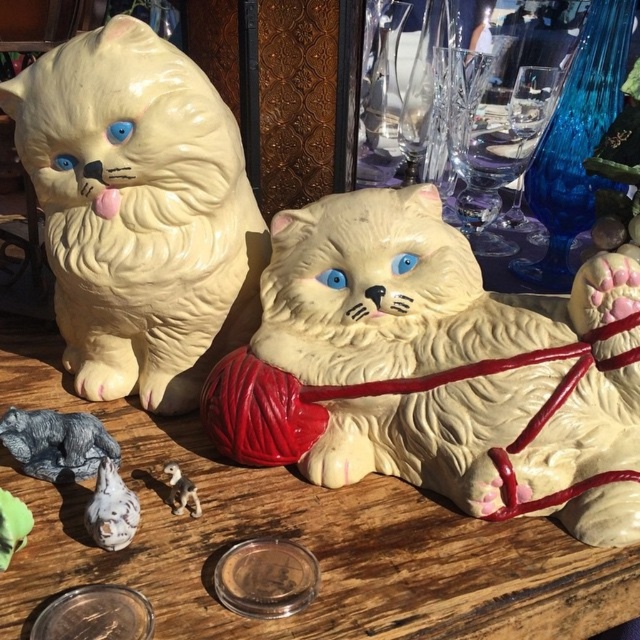
You are arranging a display and need to place a new item between the matte white cat at left and the white glossy figurine at lower center. Based on their current positions, where should you place the new item to ensure it is between them?

The new item should be placed between the matte white cat at left and the white glossy figurine at lower center, as the matte white cat at left is positioned on the left side of the white glossy figurine at lower center.

In the scene shown: You are taking a photo of the scene with a camera that has a 24mm lens. The camera can focus on objects within 20 inches from the lens. Is the point at coordinates point (x=198, y=595) within the focus range of the camera?

The point at coordinates point (x=198, y=595) is 25.66 inches from the camera, which is beyond the 20 inches focus range. Therefore, the camera cannot focus on it.